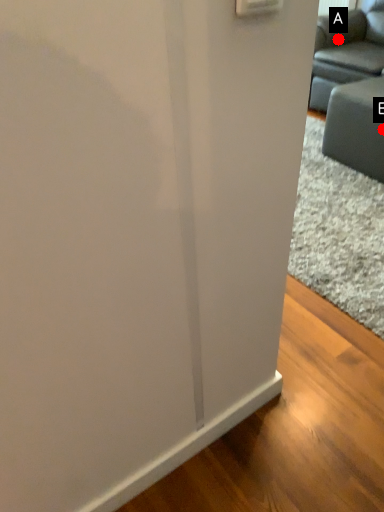
Question: Two points are circled on the image, labeled by A and B beside each circle. Which point appears closest to the camera in this image?

Choices:
 (A) A is closer
 (B) B is closer

Answer: (B)